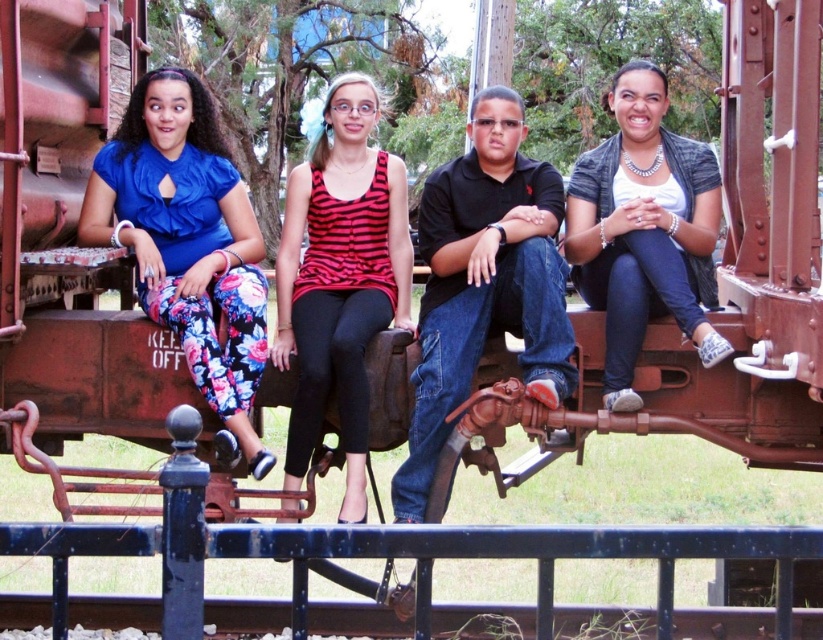
Identify the location of striped fabric tank top at center. The width and height of the screenshot is (823, 640). (340, 275).

Who is more forward, (363, 122) or (659, 189)?

Point (659, 189)

Is point (319, 346) positioned behind point (715, 339)?

Yes, it is behind point (715, 339).

You are a GUI agent. You are given a task and a screenshot of the screen. Output one action in this format:
    pyautogui.click(x=<x>, y=<y>)
    Task: Click on the striped fabric tank top at center
    This screenshot has height=640, width=823.
    Given the screenshot: What is the action you would take?
    [340, 275]

Who is positioned more to the left, denim jeans at center or blue painted metal rail at lower center?

From the viewer's perspective, blue painted metal rail at lower center appears more on the left side.

Is denim jeans at center above blue painted metal rail at lower center?

Correct, denim jeans at center is located above blue painted metal rail at lower center.

Does point (652, 136) come farther from viewer compared to point (239, 531)?

Yes, point (652, 136) is farther from viewer.

At what (x,y) coordinates should I click in order to perform the action: click on denim jeans at center. Please return your answer as a coordinate pair (x, y). Image resolution: width=823 pixels, height=640 pixels. Looking at the image, I should click on (644, 230).

Where is `blue satin blouse at left`? This screenshot has width=823, height=640. blue satin blouse at left is located at coordinates tap(188, 243).

Who is higher up, blue satin blouse at left or blue painted metal rail at lower center?

Positioned higher is blue satin blouse at left.

Find the location of `blue satin blouse at left`. blue satin blouse at left is located at coordinates (188, 243).